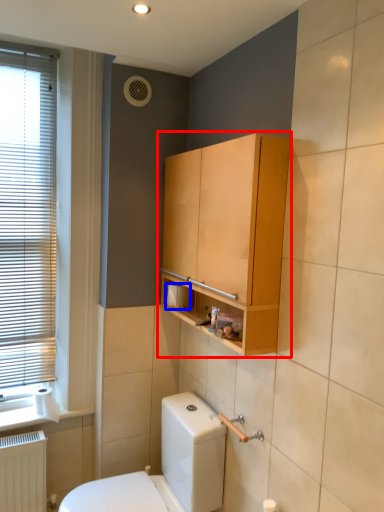
Question: Which object appears closest to the camera in this image, bathroom cabinet (highlighted by a red box) or toilet paper (highlighted by a blue box)?

Choices:
 (A) bathroom cabinet
 (B) toilet paper

Answer: (A)